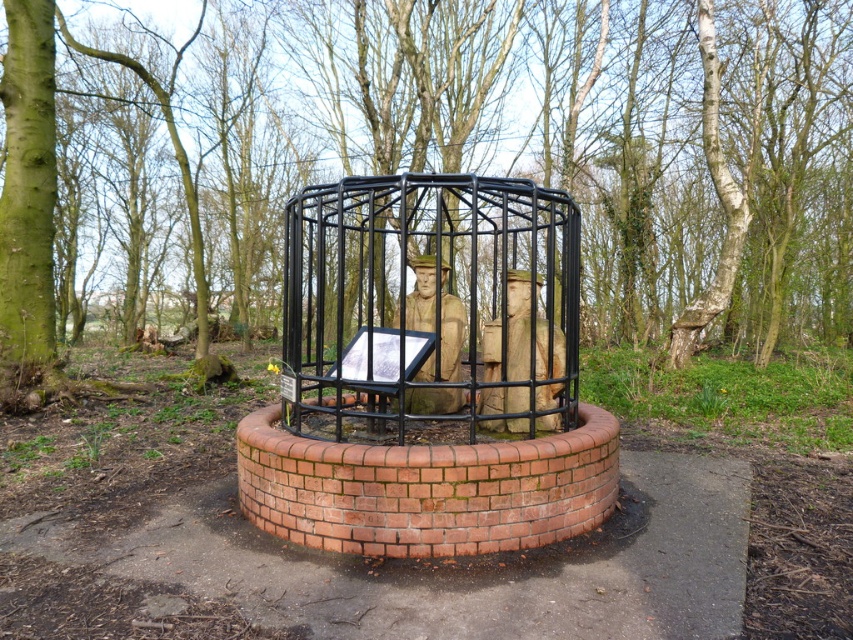
You are a park visitor standing in front of the green bark tree at center and the black metal cage at center. Which object is taller?

The green bark tree at center is much taller than the black metal cage at center.

You are standing at the center of the image and want to locate the green bark tree at center. According to the coordinates provided, in which direction should you look to find it?

The green bark tree at center is located at coordinates point (485, 148), so you should look towards the lower left direction from the center to find it.

You are standing in front of the wooden sculpture inside the black metal cage. There are two points marked on the cage. One is at coordinate point (595, 220) and the other at point (500, 417). Which point is closer to you?

Point (595, 220) is closer to you because it is further to the viewer than point (500, 417).